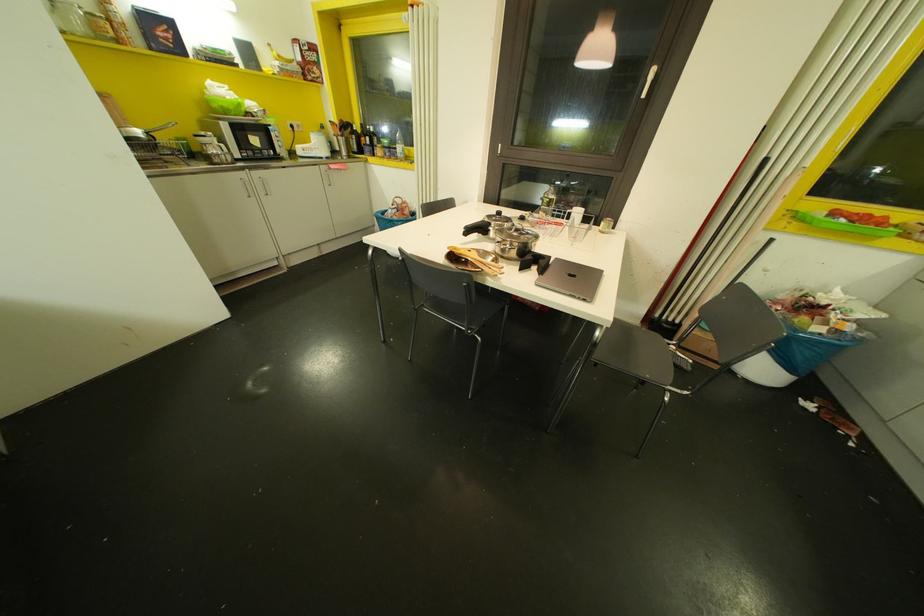
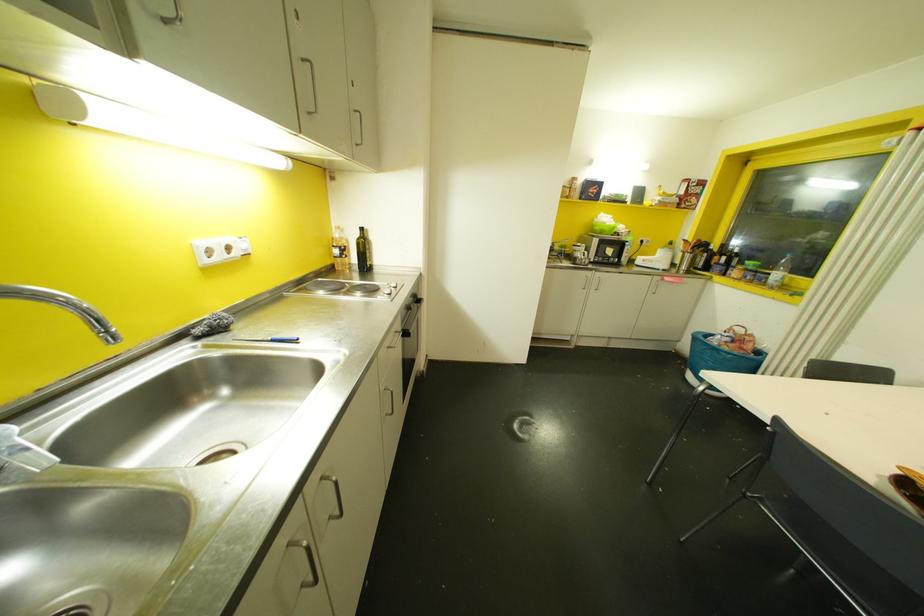
Where in the second image is the point corresponding to point (398, 147) from the first image?

(776, 274)